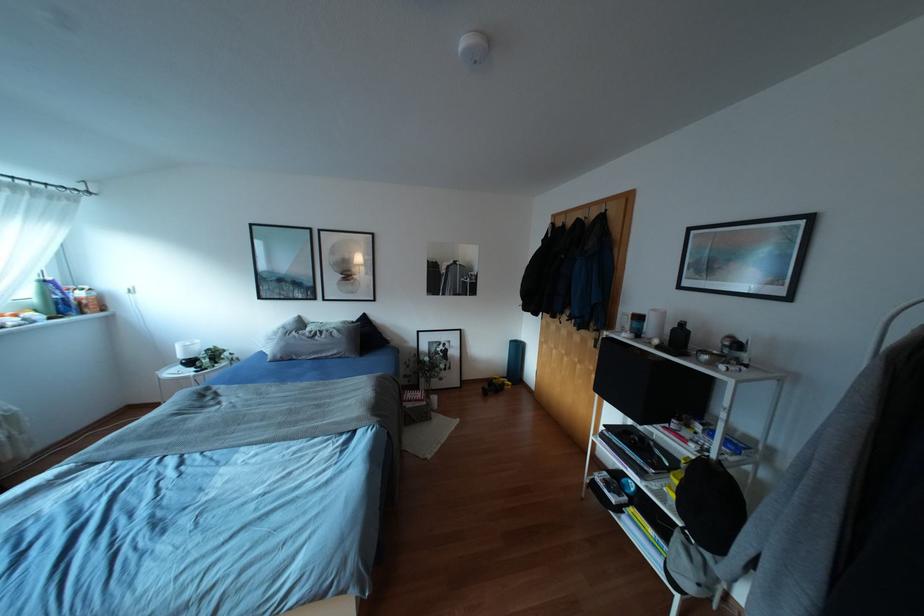
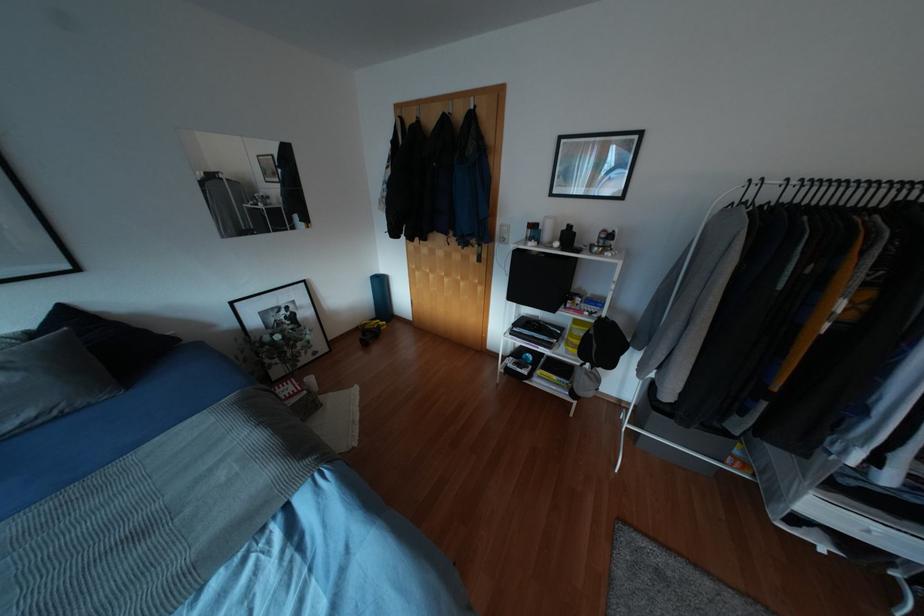
How did the camera likely rotate?

The rotation direction of the camera is right-down.